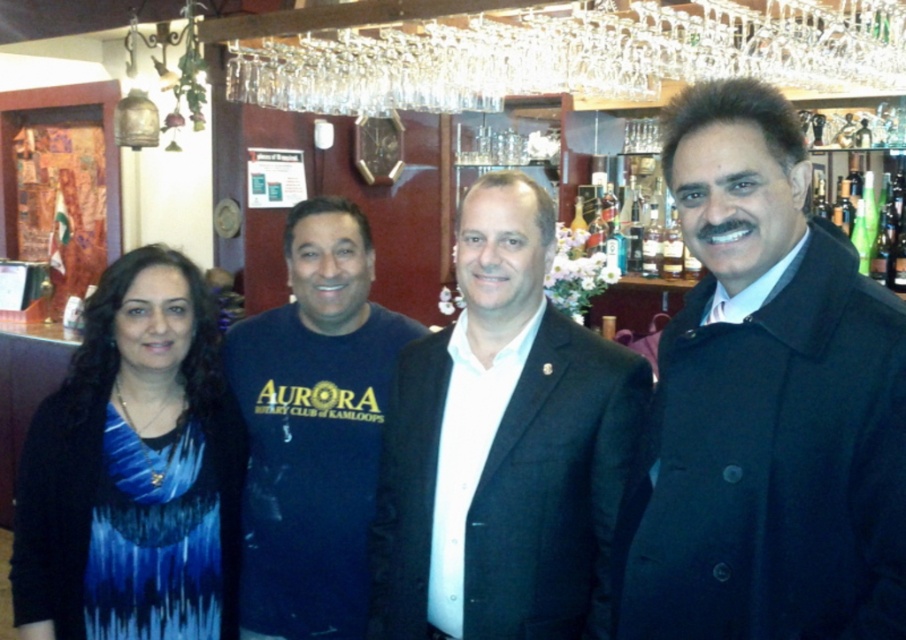
Question: Considering the real-world distances, which object is farthest from the dark blue t-shirt at center?

Choices:
 (A) black matte suit at center
 (B) black wool coat at center

Answer: (B)

Question: Is the position of black wool coat at center more distant than that of blue printed dress at left?

Choices:
 (A) no
 (B) yes

Answer: (A)

Question: Is black wool coat at center wider than dark blue t-shirt at center?

Choices:
 (A) yes
 (B) no

Answer: (B)

Question: Which of the following is the farthest from the observer?

Choices:
 (A) 624,452
 (B) 89,458
 (C) 329,614
 (D) 797,173

Answer: (C)

Question: Which of these objects is positioned farthest from the dark blue t-shirt at center?

Choices:
 (A) black wool coat at center
 (B) blue printed dress at left

Answer: (A)

Question: Considering the relative positions of black wool coat at center and blue printed dress at left in the image provided, where is black wool coat at center located with respect to blue printed dress at left?

Choices:
 (A) above
 (B) below

Answer: (A)